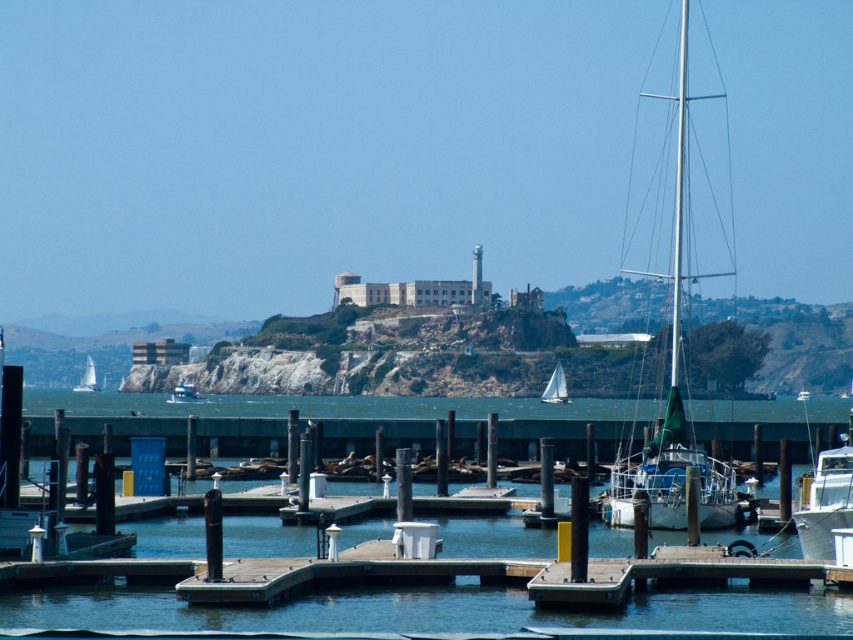
Consider the image. Is white glossy boat at lower right wider than white sailboat at center?

No, white glossy boat at lower right is not wider than white sailboat at center.

Is point (804, 504) closer to viewer compared to point (561, 380)?

Yes, point (804, 504) is closer to viewer.

Locate an element on the screen. The image size is (853, 640). white glossy boat at lower right is located at coordinates (825, 502).

Between transparent blue water at center and white sailboat at center, which one appears on the left side from the viewer's perspective?

transparent blue water at center

From the picture: Between transparent blue water at center and white sailboat at center, which one is positioned higher?

Positioned higher is white sailboat at center.

Between point (126, 618) and point (544, 387), which one is positioned behind?

The point (544, 387) is behind.

The height and width of the screenshot is (640, 853). In order to click on transparent blue water at center in this screenshot , I will do `click(431, 609)`.

Measure the distance from silver metallic mast at right to white glossy boat at lower right.

164.57 feet

Identify the location of silver metallic mast at right. (682, 211).